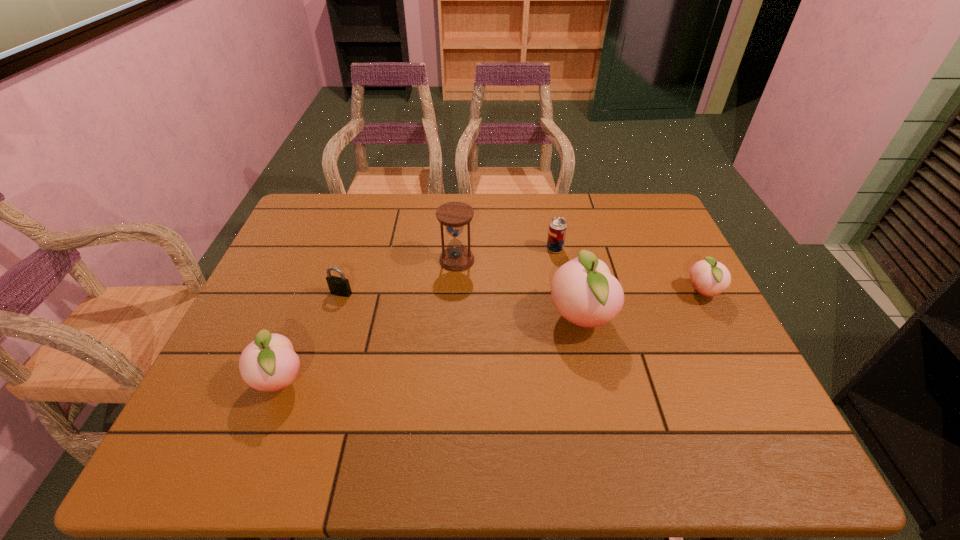
Image resolution: width=960 pixels, height=540 pixels. I want to click on vacant region located 0.170m on the right of the second peach from left to right, so click(x=680, y=319).

Find the location of a particular element. This screenshot has width=960, height=540. vacant region located 0.220m on the back of the rightmost object is located at coordinates (671, 232).

I want to click on free space located on the back of the beer can, so click(551, 228).

Locate an element on the screen. vacant space located 0.380m on the right of the hourglass is located at coordinates (x=605, y=260).

The height and width of the screenshot is (540, 960). Identify the location of vacant space positioned on the front of the padlock. (320, 358).

Find the location of a particular element. This screenshot has height=540, width=960. object situated at the near edge is located at coordinates (269, 363).

The image size is (960, 540). I want to click on object present at the left edge, so click(x=269, y=363).

Locate an element on the screen. The height and width of the screenshot is (540, 960). object that is positioned at the right edge is located at coordinates (710, 278).

You are a GUI agent. You are given a task and a screenshot of the screen. Output one action in this format:
    pyautogui.click(x=<x>, y=<y>)
    Task: Click on the object present at the near left corner
    
    Given the screenshot: What is the action you would take?
    pyautogui.click(x=269, y=363)

You are a GUI agent. You are given a task and a screenshot of the screen. Output one action in this format:
    pyautogui.click(x=<x>, y=<y>)
    Task: Click on the vacant region at the far edge
    The width and height of the screenshot is (960, 540).
    Given the screenshot: What is the action you would take?
    pyautogui.click(x=492, y=213)